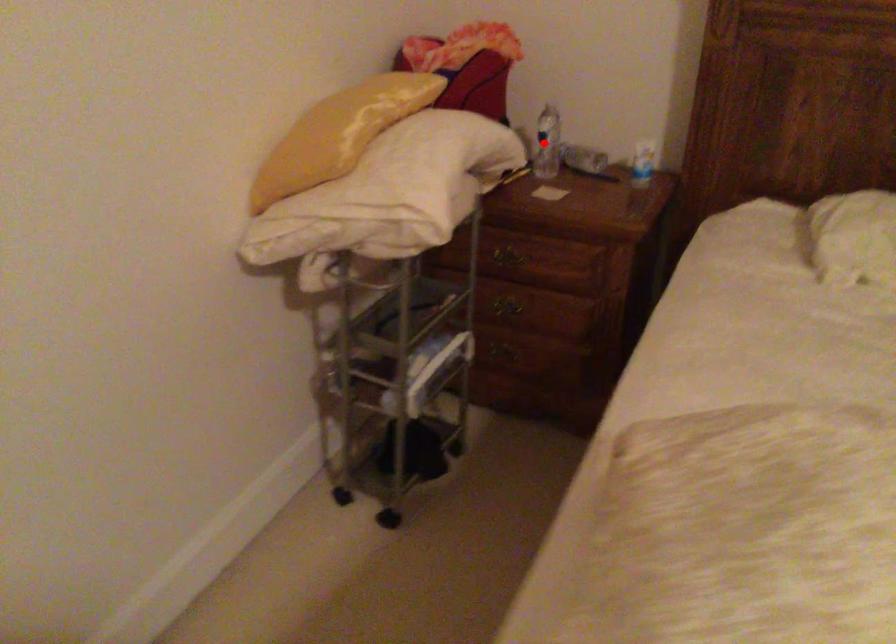
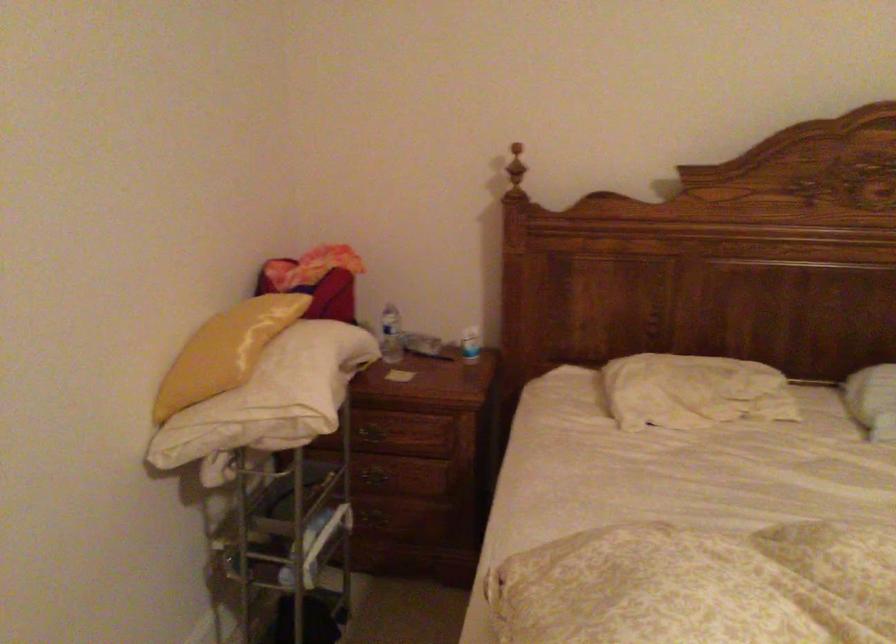
The point at the highlighted location is marked in the first image. Where is the corresponding point in the second image?

(391, 335)